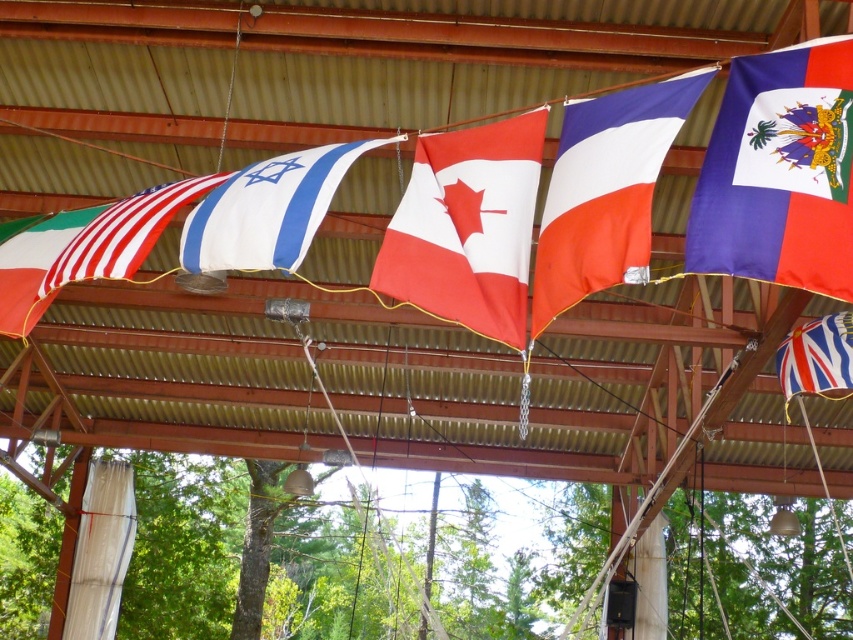
Question: Which object is positioned farthest from the white fabric flag at center?

Choices:
 (A) red/white fabric canadian flag at center
 (B) blue fabric flag at upper right

Answer: (B)

Question: Can you confirm if red/white fabric canadian flag at center is positioned below striped cotton flag at upper right?

Choices:
 (A) yes
 (B) no

Answer: (B)

Question: Which is farther from the blue fabric flag at upper right?

Choices:
 (A) striped cotton flag at upper right
 (B) white fabric flag at center
 (C) white cotton flag at center
 (D) matte white flag at left

Answer: (D)

Question: Does blue fabric flag at upper right appear under white cotton flag at center?

Choices:
 (A) yes
 (B) no

Answer: (B)

Question: Which object is positioned closest to the white cotton flag at center?

Choices:
 (A) red/white fabric canadian flag at center
 (B) matte white flag at left
 (C) white fabric flag at center
 (D) blue fabric flag at upper right

Answer: (A)

Question: Is red/white fabric canadian flag at center below white fabric flag at center?

Choices:
 (A) yes
 (B) no

Answer: (A)